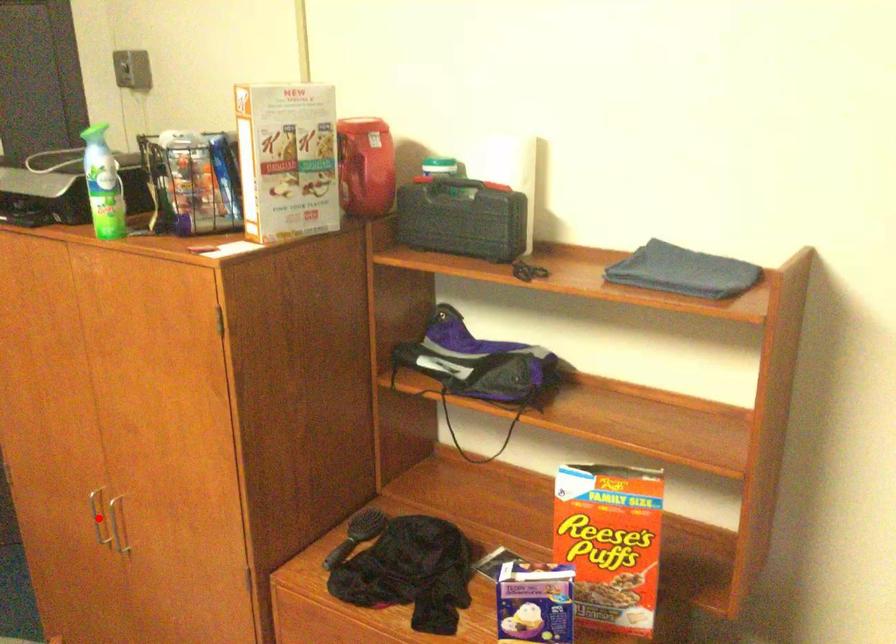
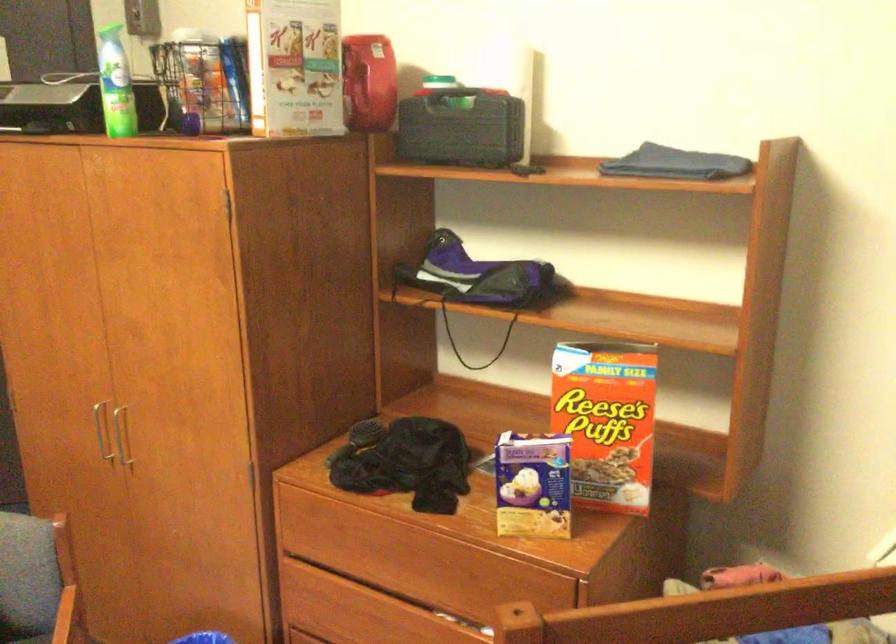
Locate, in the second image, the point that corresponds to the highlighted location in the first image.

(100, 431)